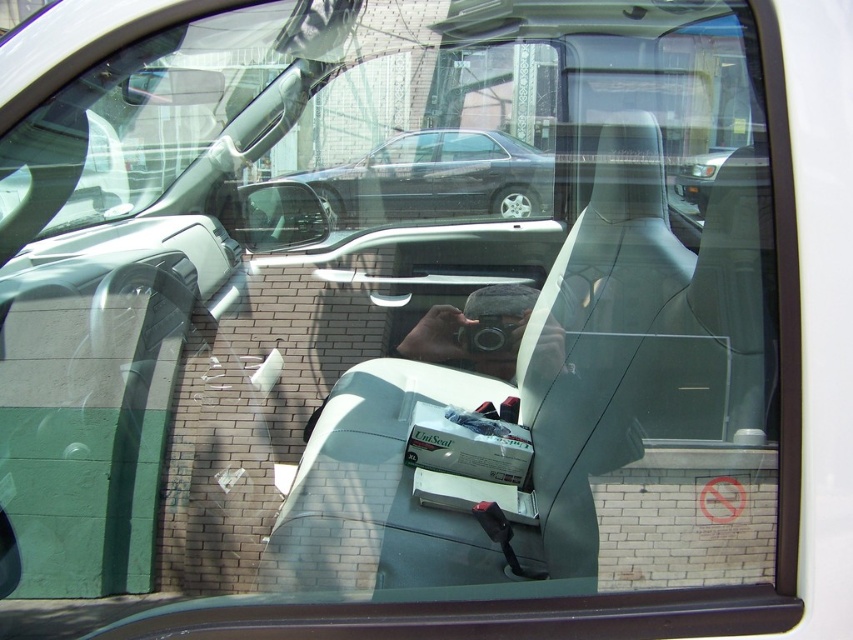
Question: Can you confirm if shiny black sedan at center is smaller than matte plastic side mirror at upper left?

Choices:
 (A) no
 (B) yes

Answer: (A)

Question: Which point appears closest to the camera in this image?

Choices:
 (A) (270, 225)
 (B) (426, 160)

Answer: (A)

Question: Is shiny black sedan at center smaller than matte plastic side mirror at upper left?

Choices:
 (A) no
 (B) yes

Answer: (A)

Question: Considering the relative positions of shiny black sedan at center and matte plastic side mirror at upper left in the image provided, where is shiny black sedan at center located with respect to matte plastic side mirror at upper left?

Choices:
 (A) below
 (B) above

Answer: (B)

Question: Which point is farther from the camera taking this photo?

Choices:
 (A) (287, 188)
 (B) (538, 196)

Answer: (B)